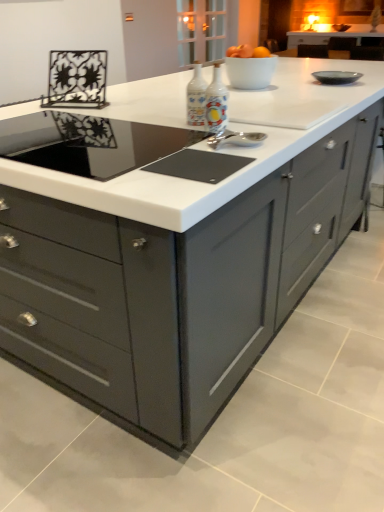
Question: In terms of height, does matte glass bottles at center, positioned as the first appliance in left-to-right order, look taller or shorter compared to black glass cooktop at center?

Choices:
 (A) short
 (B) tall

Answer: (B)

Question: From a real-world perspective, relative to black glass cooktop at center, is matte glass bottles at center, the 2th appliance when ordered from right to left, vertically above or below?

Choices:
 (A) below
 (B) above

Answer: (B)

Question: Which is farther from the matte glass bottles at center, the 2th appliance when ordered from right to left?

Choices:
 (A) black glass cooktop at center
 (B) matte gray cabinet at right
 (C) porcelain bottles at center, positioned as the first appliance in right-to-left order

Answer: (B)

Question: Which of these objects is positioned closest to the porcelain bottles at center, positioned as the first appliance in right-to-left order?

Choices:
 (A) black glass cooktop at center
 (B) matte gray cabinet at right
 (C) matte glass bottles at center, the 2th appliance when ordered from right to left

Answer: (C)